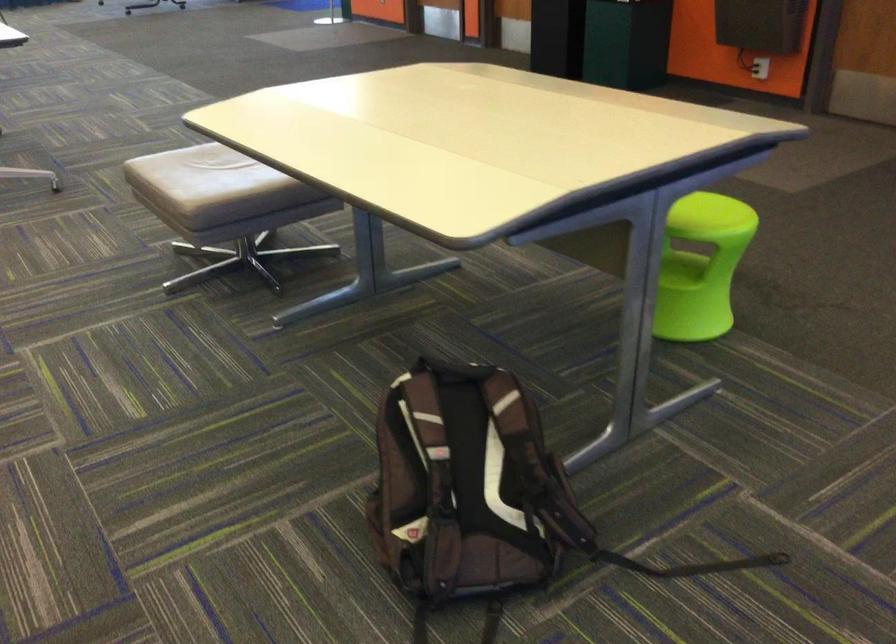
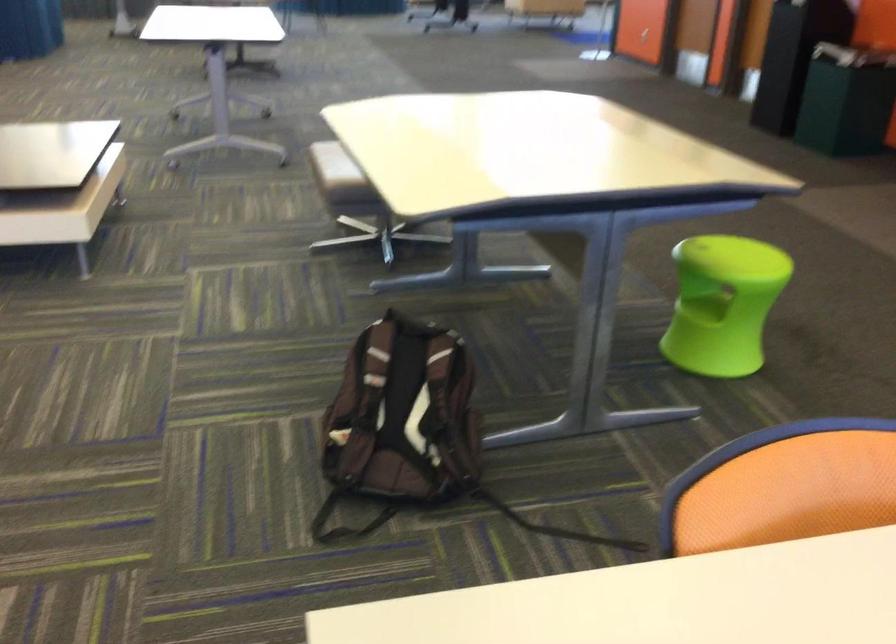
Question: The camera is either moving clockwise (left) or counter-clockwise (right) around the object. The first image is from the beginning of the video and the second image is from the end. Is the camera moving left or right when shooting the video?

Choices:
 (A) Left
 (B) Right

Answer: (B)